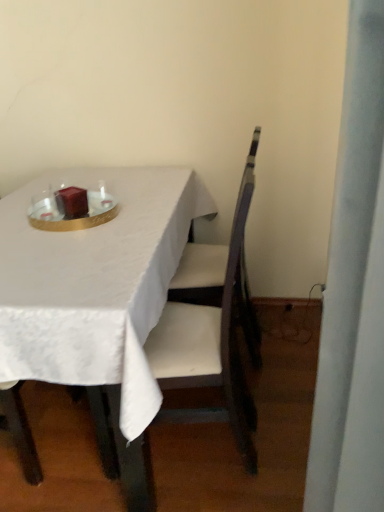
Describe the element at coordinates (74, 217) in the screenshot. I see `shiny gold tray at center` at that location.

In order to face matte brown candle at center, should I rotate leftwards or rightwards?

It's best to rotate left around 15.873 degrees.

Describe the element at coordinates (95, 284) in the screenshot. I see `white fabric table at center` at that location.

Find the location of a particular element. The height and width of the screenshot is (512, 384). wooden chair at center is located at coordinates (212, 322).

Can you confirm if matte brown candle at center is bigger than white fabric table at center?

Incorrect, matte brown candle at center is not larger than white fabric table at center.

From the image's perspective, which one is positioned lower, matte brown candle at center or white fabric table at center?

white fabric table at center.

Would you consider matte brown candle at center to be distant from white fabric table at center?

Actually, matte brown candle at center and white fabric table at center are a little close together.

Measure the distance from white fabric table at center to shiny gold tray at center.

white fabric table at center is 8.65 inches from shiny gold tray at center.

Is white fabric table at center facing towards shiny gold tray at center?

No, white fabric table at center does not turn towards shiny gold tray at center.

From a real-world perspective, is white fabric table at center beneath shiny gold tray at center?

Correct, in the physical world, white fabric table at center is lower than shiny gold tray at center.

The height and width of the screenshot is (512, 384). I want to click on chair that is under the matte brown candle at center (from a real-world perspective), so click(x=212, y=322).

Relative to wooden chair at center, is matte brown candle at center in front or behind?

matte brown candle at center is behind wooden chair at center.

Is matte brown candle at center aimed at wooden chair at center?

No, matte brown candle at center does not turn towards wooden chair at center.

Between point (82, 181) and point (61, 213), which one is positioned in front?

The point (61, 213) is in front.

Is white fabric table at center with matte brown candle at center?

white fabric table at center is not next to matte brown candle at center, and they're not touching.

In the scene shown: Is white fabric table at center at the left side of matte brown candle at center?

No, white fabric table at center is not to the left of matte brown candle at center.

The image size is (384, 512). I want to click on chair below the shiny gold tray at center (from the image's perspective), so click(212, 322).

Is wooden chair at center closer to the viewer compared to shiny gold tray at center?

Yes, it is.

Is wooden chair at center positioned far away from shiny gold tray at center?

No, there isn't a large distance between wooden chair at center and shiny gold tray at center.

Does wooden chair at center turn towards shiny gold tray at center?

No, wooden chair at center is not turned towards shiny gold tray at center.

Between wooden chair at center and white fabric table at center, which one has smaller width?

wooden chair at center.

Which of these two, wooden chair at center or white fabric table at center, is bigger?

white fabric table at center.

Does point (186, 292) come closer to viewer compared to point (58, 310)?

No, it is not.

Which is in front, wooden chair at center or white fabric table at center?

white fabric table at center is more forward.

In terms of height, does shiny gold tray at center look taller or shorter compared to white fabric table at center?

Considering their sizes, shiny gold tray at center has less height than white fabric table at center.

From the image's perspective, which one is positioned higher, shiny gold tray at center or white fabric table at center?

shiny gold tray at center.

Would you say shiny gold tray at center is outside white fabric table at center?

Actually, shiny gold tray at center is at least partially inside white fabric table at center.

Considering the sizes of objects shiny gold tray at center and white fabric table at center in the image provided, who is wider, shiny gold tray at center or white fabric table at center?

With larger width is white fabric table at center.

Identify the location of candle above the white fabric table at center (from a real-world perspective). (72, 202).

At what (x,y) coordinates should I click in order to perform the action: click on table lying in front of the shiny gold tray at center. Please return your answer as a coordinate pair (x, y). Looking at the image, I should click on (95, 284).

Which object lies nearer to the anchor point matte brown candle at center, wooden chair at center or white fabric table at center?

white fabric table at center is closer to matte brown candle at center.

From the picture: Estimate the real-world distances between objects in this image. Which object is closer to shiny gold tray at center, wooden chair at center or matte brown candle at center?

matte brown candle at center.

Which object lies further to the anchor point white fabric table at center, wooden chair at center or matte brown candle at center?

matte brown candle at center is further to white fabric table at center.

When comparing their distances from matte brown candle at center, does white fabric table at center or wooden chair at center seem further?

wooden chair at center.

From the image, which object appears to be nearer to shiny gold tray at center, matte brown candle at center or wooden chair at center?

matte brown candle at center lies closer to shiny gold tray at center than the other object.

Which object lies nearer to the anchor point white fabric table at center, wooden chair at center or shiny gold tray at center?

shiny gold tray at center is positioned closer to the anchor white fabric table at center.

Considering their positions, is wooden chair at center positioned closer to shiny gold tray at center than white fabric table at center?

white fabric table at center is positioned closer to the anchor shiny gold tray at center.

From the image, which object appears to be nearer to wooden chair at center, matte brown candle at center or white fabric table at center?

Based on the image, white fabric table at center appears to be nearer to wooden chair at center.

This screenshot has width=384, height=512. I want to click on tableware located between wooden chair at center and matte brown candle at center in the depth direction, so click(74, 217).

The image size is (384, 512). In order to click on chair located between white fabric table at center and matte brown candle at center in the depth direction in this screenshot , I will do `click(212, 322)`.

Locate an element on the screen. This screenshot has height=512, width=384. tableware located between white fabric table at center and matte brown candle at center in the depth direction is located at coordinates (74, 217).

You are a GUI agent. You are given a task and a screenshot of the screen. Output one action in this format:
    pyautogui.click(x=<x>, y=<y>)
    Task: Click on the chair located between white fabric table at center and shiny gold tray at center in the depth direction
    The image size is (384, 512).
    Given the screenshot: What is the action you would take?
    pyautogui.click(x=212, y=322)